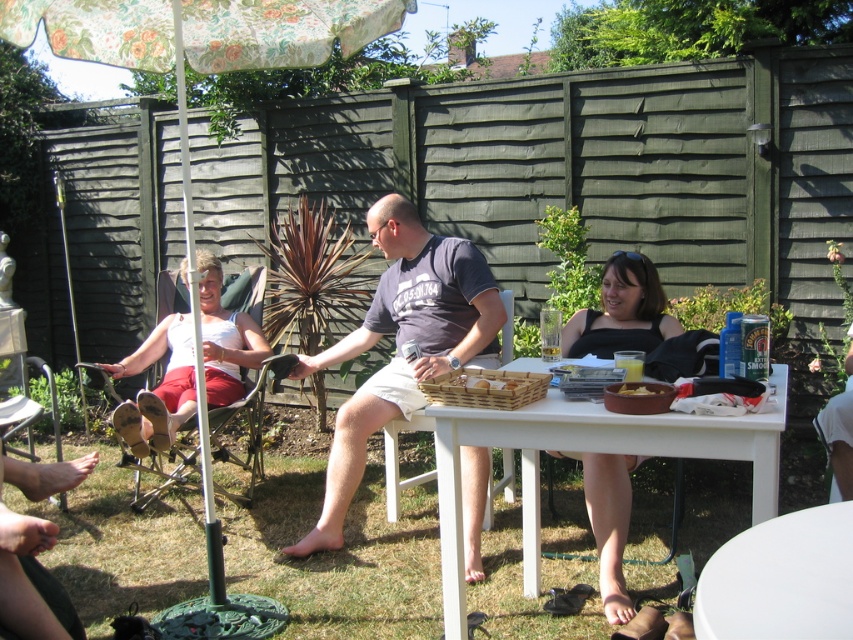
Question: Which of the following is the farthest from the observer?

Choices:
 (A) (618, 488)
 (B) (647, 384)
 (C) (743, 572)
 (D) (155, 326)

Answer: (D)

Question: Considering the real-world distances, which object is closest to the white plastic picnic table at center?

Choices:
 (A) black matte dress at center
 (B) dark gray t-shirt at center

Answer: (A)

Question: Which of the following is the farthest from the observer?

Choices:
 (A) (416, 406)
 (B) (601, 301)

Answer: (B)

Question: Is dark gray t-shirt at center positioned in front of black matte dress at center?

Choices:
 (A) no
 (B) yes

Answer: (B)

Question: Can you confirm if floral fabric umbrella at upper left is positioned to the left of white glossy table at lower right?

Choices:
 (A) yes
 (B) no

Answer: (A)

Question: Is white glossy table at lower right wider than white plastic chair at center?

Choices:
 (A) yes
 (B) no

Answer: (A)